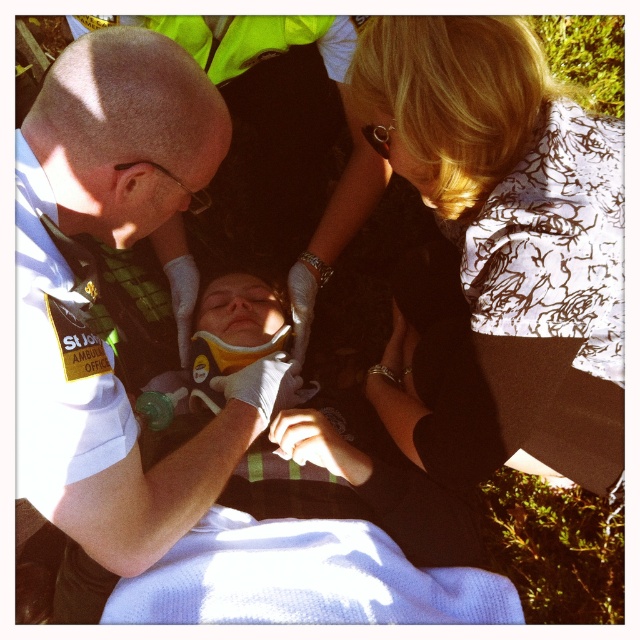
Question: Which is nearer to the yellow soft plastic at center?

Choices:
 (A) blonde hair at upper right
 (B) white matte uniform at center

Answer: (B)

Question: Is blonde hair at upper right closer to the viewer compared to yellow soft plastic at center?

Choices:
 (A) yes
 (B) no

Answer: (A)

Question: Is blonde hair at upper right further to camera compared to white matte uniform at center?

Choices:
 (A) yes
 (B) no

Answer: (A)

Question: Which point appears closest to the camera in this image?

Choices:
 (A) (216, 403)
 (B) (28, 250)

Answer: (B)

Question: Does blonde hair at upper right have a larger size compared to yellow soft plastic at center?

Choices:
 (A) yes
 (B) no

Answer: (A)

Question: Which of these objects is positioned closest to the blonde hair at upper right?

Choices:
 (A) yellow soft plastic at center
 (B) white matte uniform at center

Answer: (A)